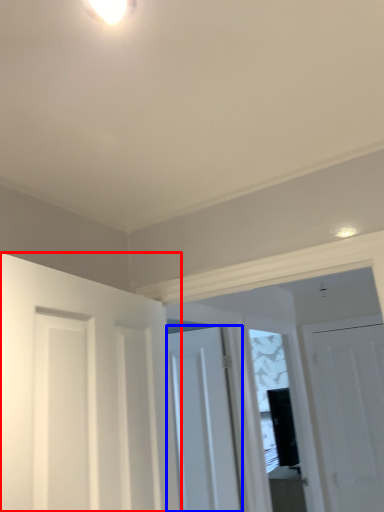
Question: Among these objects, which one is farthest to the camera, door (highlighted by a red box) or door (highlighted by a blue box)?

Choices:
 (A) door
 (B) door

Answer: (B)